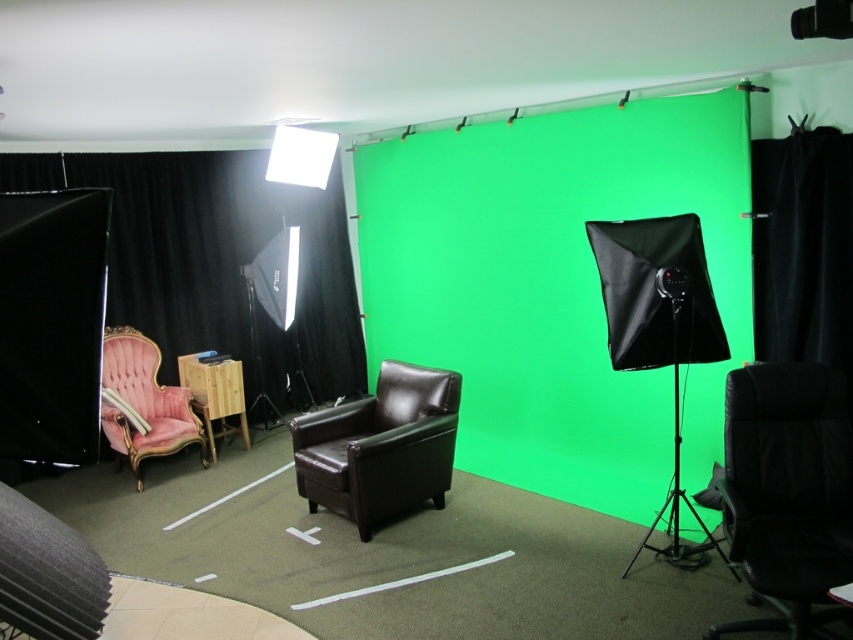
Is black velvet curtain at left taller than wooden side table at lower left?

Yes, black velvet curtain at left is taller than wooden side table at lower left.

Which is more to the right, black velvet curtain at left or wooden side table at lower left?

black velvet curtain at left is more to the right.

I want to click on black velvet curtain at left, so click(x=218, y=260).

At what (x,y) coordinates should I click in order to perform the action: click on black velvet curtain at left. Please return your answer as a coordinate pair (x, y). This screenshot has height=640, width=853. Looking at the image, I should click on (218, 260).

Does black leather office chair at lower right appear on the right side of wooden side table at lower left?

Correct, you'll find black leather office chair at lower right to the right of wooden side table at lower left.

Describe the element at coordinates (787, 492) in the screenshot. I see `black leather office chair at lower right` at that location.

Identify the location of black leather office chair at lower right. (787, 492).

Is black velvet curtain at left below black leather office chair at lower right?

No, black velvet curtain at left is not below black leather office chair at lower right.

Is point (175, 216) in front of point (779, 387)?

No, it is not.

Where is `black velvet curtain at left`? black velvet curtain at left is located at coordinates (218, 260).